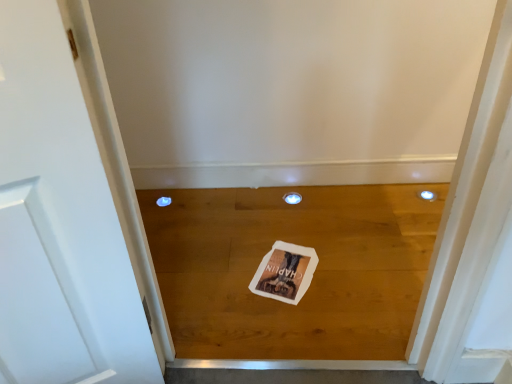
Question: In terms of height, does wooden floor at center look taller or shorter compared to white paper postcard at center?

Choices:
 (A) tall
 (B) short

Answer: (A)

Question: From a real-world perspective, is wooden floor at center above or below white paper postcard at center?

Choices:
 (A) above
 (B) below

Answer: (B)

Question: Considering the positions of wooden floor at center and white paper postcard at center in the image, is wooden floor at center wider or thinner than white paper postcard at center?

Choices:
 (A) thin
 (B) wide

Answer: (B)

Question: From the image's perspective, relative to wooden floor at center, is white paper postcard at center above or below?

Choices:
 (A) below
 (B) above

Answer: (A)

Question: Considering their positions, is white paper postcard at center located in front of or behind wooden floor at center?

Choices:
 (A) front
 (B) behind

Answer: (B)

Question: Is white paper postcard at center inside or outside of wooden floor at center?

Choices:
 (A) inside
 (B) outside

Answer: (A)

Question: Does point (271, 292) appear closer or farther from the camera than point (375, 329)?

Choices:
 (A) farther
 (B) closer

Answer: (A)